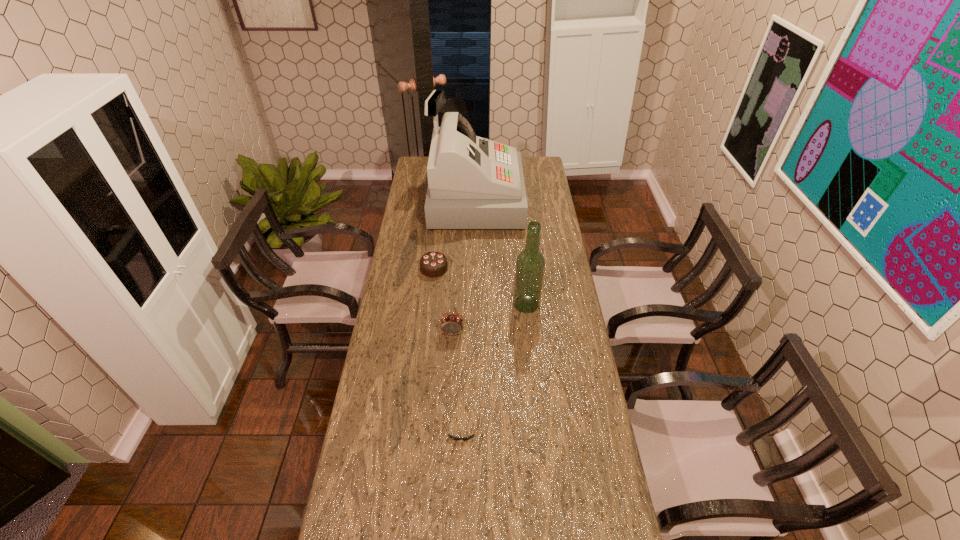
Find the location of `object that is at the far left corner`. object that is at the far left corner is located at coordinates (473, 183).

Where is `object that is at the far right corner`? The height and width of the screenshot is (540, 960). object that is at the far right corner is located at coordinates coord(473,183).

In the image, there is a desktop. Identify the location of vacant space at the left edge. The width and height of the screenshot is (960, 540). (394, 287).

Locate an element on the screen. free space at the right edge is located at coordinates (554, 301).

Find the location of a particular element. The width and height of the screenshot is (960, 540). free location at the far left corner of the desktop is located at coordinates (414, 176).

The width and height of the screenshot is (960, 540). I want to click on free location at the far right corner of the desktop, so click(x=540, y=162).

Locate an element on the screen. free space that is in between the sunglasses and the second farthest object is located at coordinates (447, 348).

This screenshot has height=540, width=960. What are the coordinates of `blank region between the fourth nearest object and the farthest object` in the screenshot? It's located at (500, 253).

At what (x,y) coordinates should I click in order to perform the action: click on free point between the second farthest object and the second tallest object. Please return your answer as a coordinate pair (x, y). The height and width of the screenshot is (540, 960). Looking at the image, I should click on (480, 287).

This screenshot has width=960, height=540. In order to click on free space between the tallest object and the third tallest object in this screenshot , I will do `click(464, 267)`.